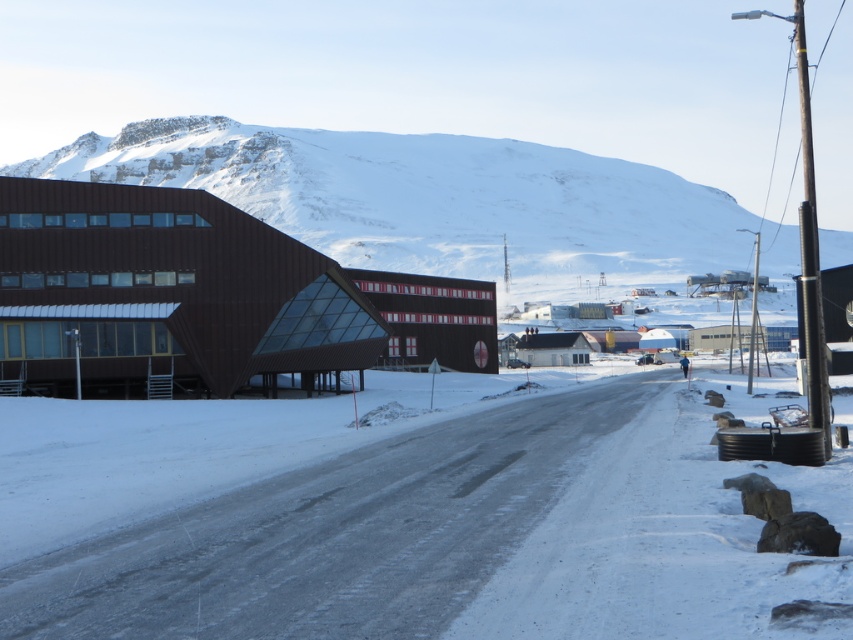
The image size is (853, 640). What do you see at coordinates (450, 540) in the screenshot?
I see `white powdery snow at center` at bounding box center [450, 540].

Does white powdery snow at center have a larger size compared to snowy mountain at upper center?

No.

Identify the location of white powdery snow at center. (450, 540).